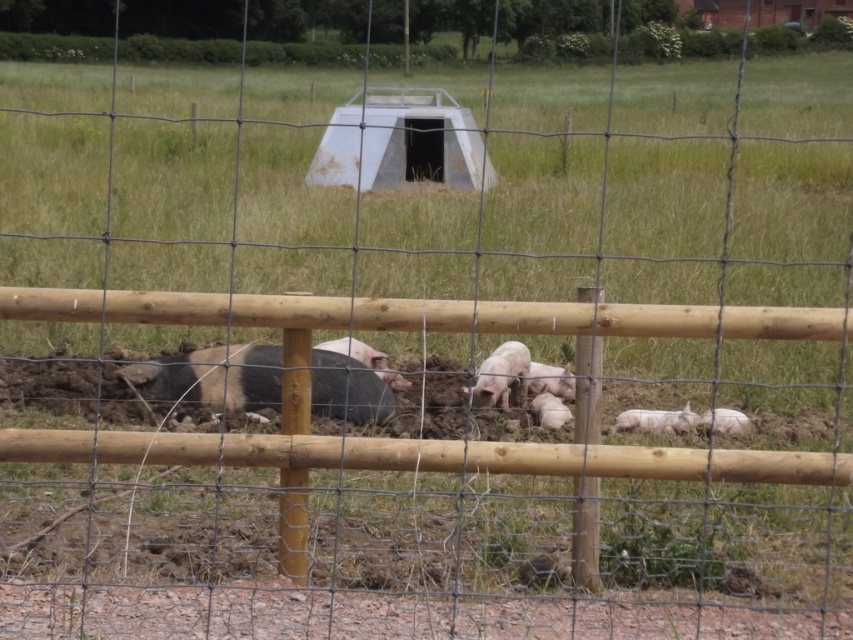
You are a farmer checking on your pigs. You notice two pigs at the center of the fenced area. Which pig is closer to the ground, the pink matte pig at center or the pink smooth pig at center?

The pink matte pig at center is closer to the ground because it is positioned below the pink smooth pig at center.

You are standing in the fenced area with the pigs and want to walk from point (500, 387) to point (611, 429). Which direction should you move relative to your current position?

You should move backward because point (611, 429) is further away from you than point (500, 387).

You are a farmer who wants to place a new feeding trough between the pink smooth pig at center and the white matte piglet at center. The trough is 1.2 meters wide. Can it fit between them without moving either animal?

The pink smooth pig at center might be wider than white matte piglet at center. Since the trough is 1.2 meters wide, it depends on the actual width of the pigs. If the combined width of both animals is less than 1.2 meters, the trough can fit. However, if their combined width exceeds 1.2 meters, it won not fit without moving them.